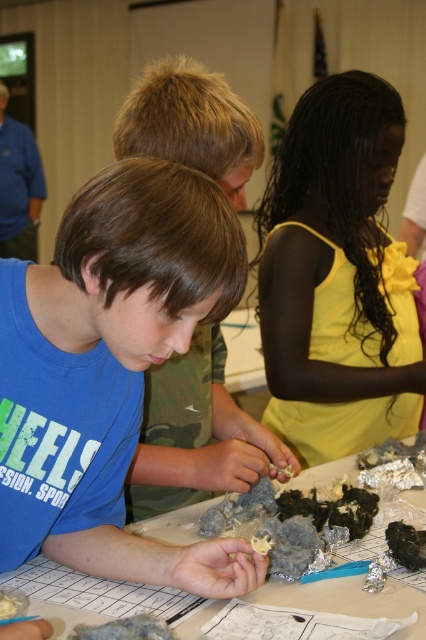
Question: Does brown matte hair at center appear over white paper at center?

Choices:
 (A) no
 (B) yes

Answer: (B)

Question: Is yellow satin dress at center positioned in front of black crumbly rock at center?

Choices:
 (A) no
 (B) yes

Answer: (A)

Question: Is brown matte hair at center closer to camera compared to white crumbly food at center?

Choices:
 (A) yes
 (B) no

Answer: (B)

Question: Which point is farther from the camera taking this photo?

Choices:
 (A) (270, 221)
 (B) (198, 188)
 (C) (408, 547)
 (D) (161, 120)

Answer: (A)

Question: Among these points, which one is nearest to the camera?

Choices:
 (A) (411, 552)
 (B) (290, 172)

Answer: (A)

Question: Based on their relative distances, which object is nearer to the matte blue shirt at center?

Choices:
 (A) yellow satin dress at center
 (B) brown matte hair at center
 (C) white paper at center
 (D) black crumbly rock at center

Answer: (B)